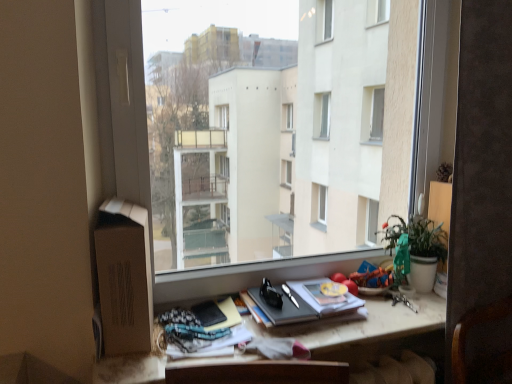
You are a GUI agent. You are given a task and a screenshot of the screen. Output one action in this format:
    pyautogui.click(x=<x>, y=<y>)
    Task: Click on the vacant space in front of green matte plant at right
    
    Given the screenshot: What is the action you would take?
    pyautogui.click(x=413, y=309)